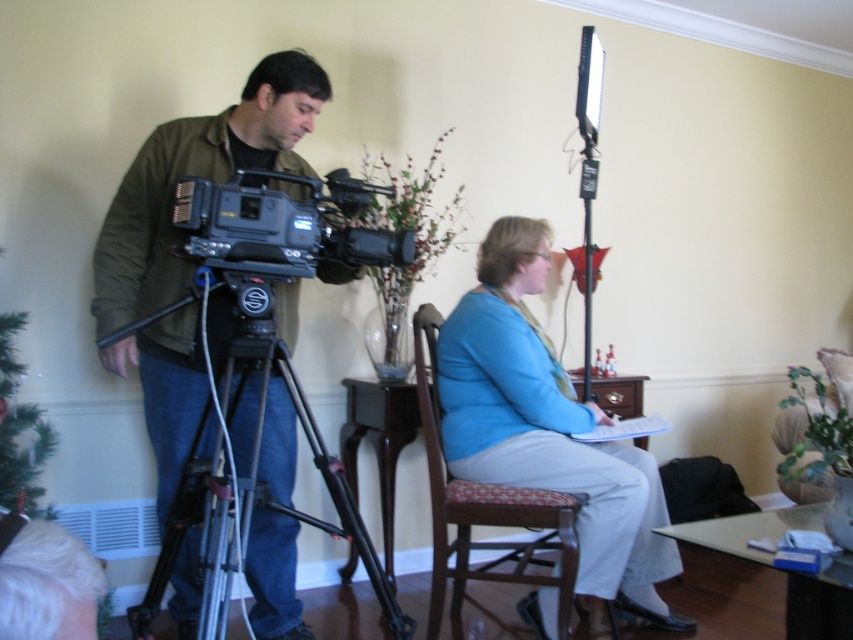
Is silver metallic tripod at left taller than black plastic video camera at left?

Yes.

Based on the photo, measure the distance between silver metallic tripod at left and black plastic video camera at left.

silver metallic tripod at left is 15.05 inches from black plastic video camera at left.

Is point (206, 465) positioned before point (387, 244)?

Yes, it is.

The width and height of the screenshot is (853, 640). I want to click on silver metallic tripod at left, so click(247, 483).

Can you confirm if matte black camera at left is positioned to the left of black plastic video camera at left?

Indeed, matte black camera at left is positioned on the left side of black plastic video camera at left.

What do you see at coordinates (200, 177) in the screenshot? This screenshot has height=640, width=853. I see `matte black camera at left` at bounding box center [200, 177].

I want to click on matte black camera at left, so click(200, 177).

Between blue fabric shirt at center and woodenchair at center, which one appears on the left side from the viewer's perspective?

From the viewer's perspective, woodenchair at center appears more on the left side.

Who is more distant from viewer, (x=490, y=477) or (x=567, y=616)?

Positioned behind is point (x=490, y=477).

The image size is (853, 640). Find the location of `blue fabric shirt at center`. blue fabric shirt at center is located at coordinates pos(548,429).